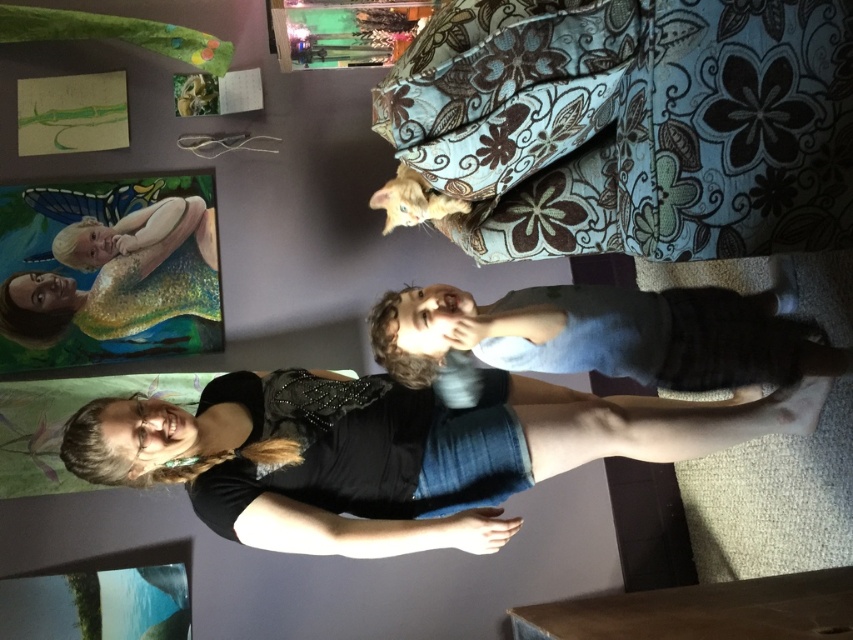
Question: Is light blue fabric at center to the right of matte black shirt at lower left from the viewer's perspective?

Choices:
 (A) yes
 (B) no

Answer: (A)

Question: Considering the real-world distances, which object is closest to the matte black shirt at lower left?

Choices:
 (A) light blue fabric at center
 (B) black denim shorts at lower center

Answer: (B)

Question: Which point is closer to the camera?

Choices:
 (A) (688, 362)
 (B) (138, 276)
 (C) (480, 474)

Answer: (A)

Question: Which point is closer to the camera?

Choices:
 (A) light blue fabric at center
 (B) black denim shorts at lower center

Answer: (B)

Question: Does black denim shorts at lower center have a lesser width compared to matte black shirt at lower left?

Choices:
 (A) yes
 (B) no

Answer: (B)

Question: Considering the relative positions of black denim shorts at lower center and matte black shirt at lower left in the image provided, where is black denim shorts at lower center located with respect to matte black shirt at lower left?

Choices:
 (A) above
 (B) below

Answer: (B)